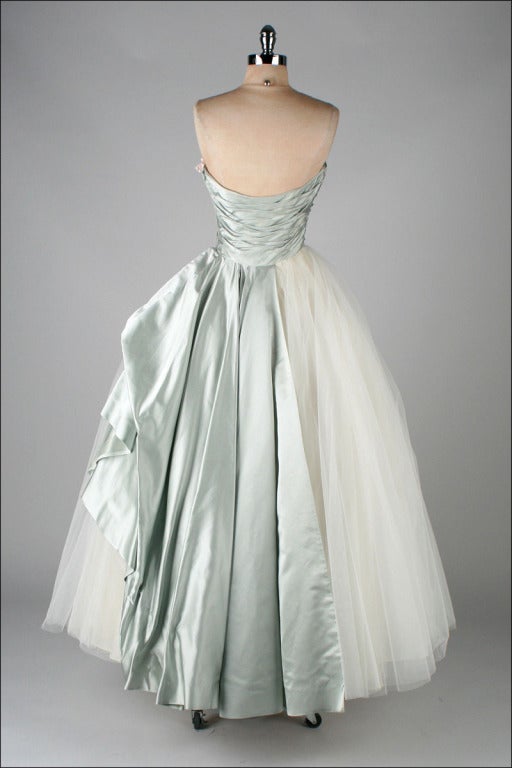
The width and height of the screenshot is (512, 768). Find the location of `mannequin`. mannequin is located at coordinates (275, 137).